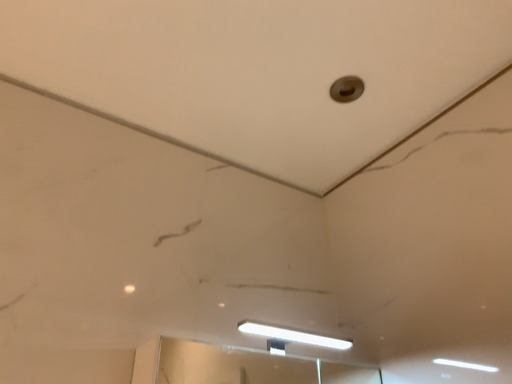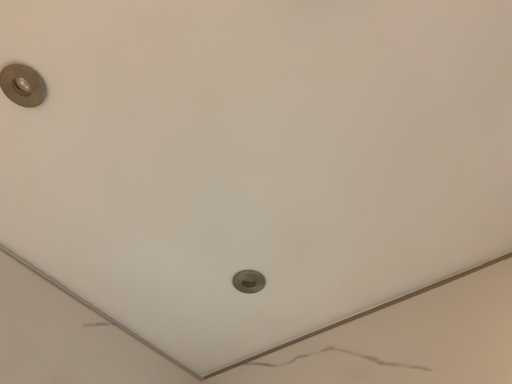
Question: How did the camera likely rotate when shooting the video?

Choices:
 (A) rotated right
 (B) rotated left

Answer: (A)